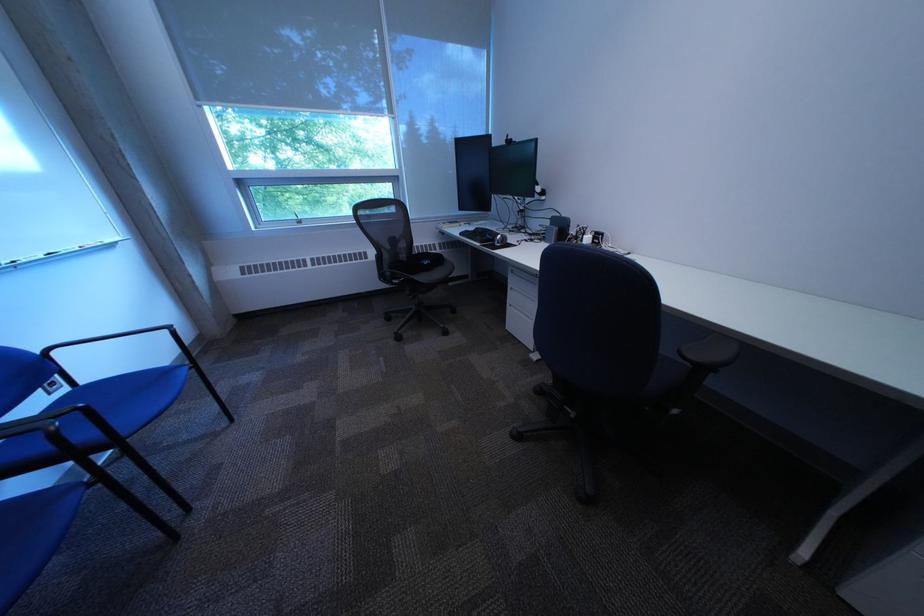
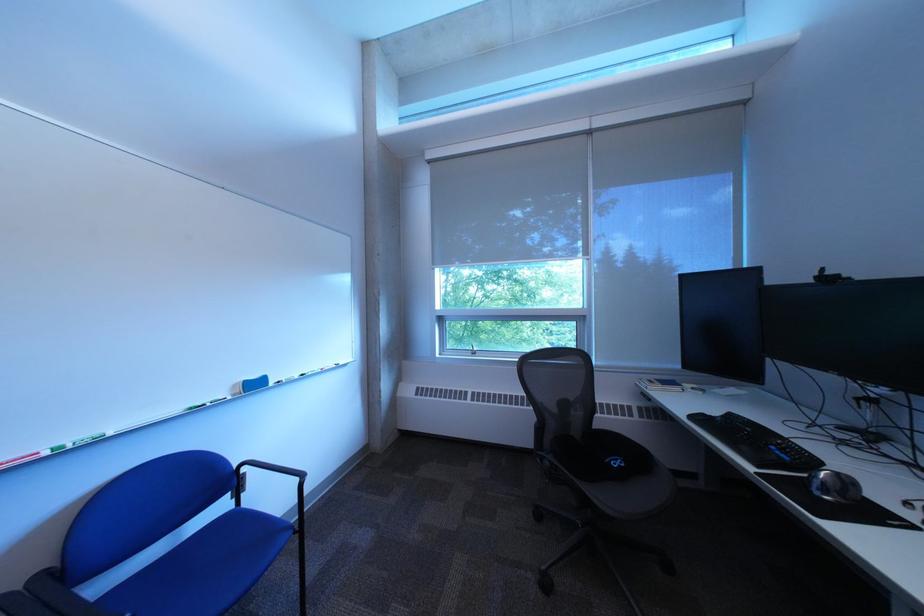
The first image is from the beginning of the video and the second image is from the end. How did the camera likely rotate when shooting the video?

The camera rotated toward left-up.